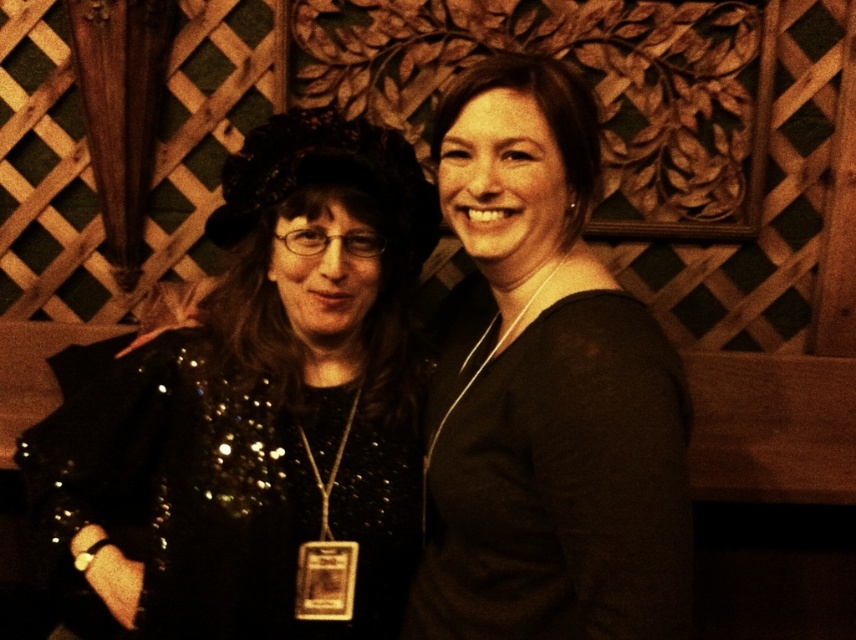
Can you confirm if black sequined dress at left is positioned to the left of black matte dress at center?

Yes, black sequined dress at left is to the left of black matte dress at center.

Is point (93, 582) behind point (485, 333)?

That is False.

This screenshot has height=640, width=856. Describe the element at coordinates (265, 408) in the screenshot. I see `black sequined dress at left` at that location.

Locate an element on the screen. The image size is (856, 640). black sequined dress at left is located at coordinates 265,408.